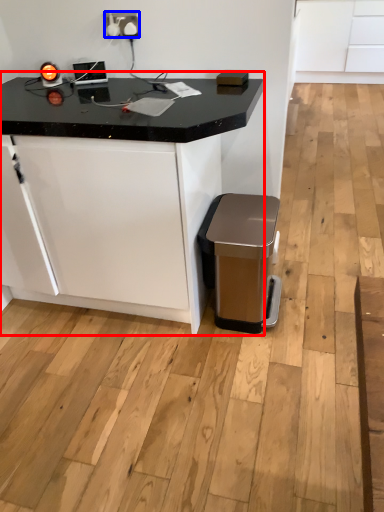
Question: Which of the following is the closest to the observer, table (highlighted by a red box) or electric outlet (highlighted by a blue box)?

Choices:
 (A) table
 (B) electric outlet

Answer: (A)